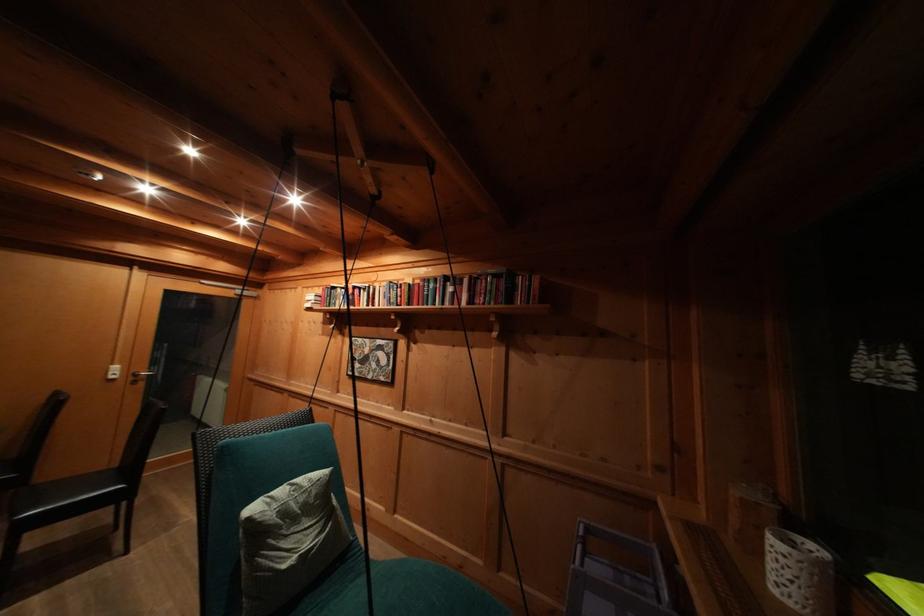
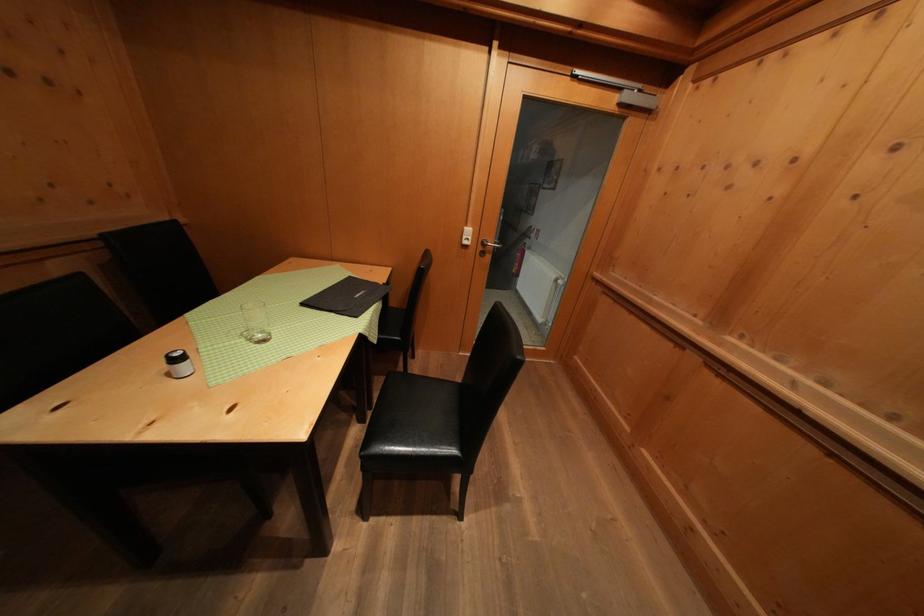
The point at (x=141, y=379) is marked in the first image. Where is the corresponding point in the second image?

(490, 249)